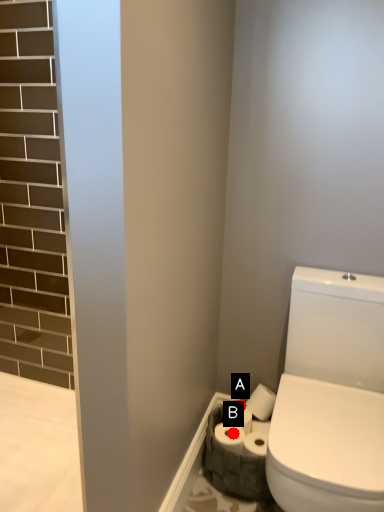
Question: Two points are circled on the image, labeled by A and B beside each circle. Among these points, which one is nearest to the camera?

Choices:
 (A) A is closer
 (B) B is closer

Answer: (B)